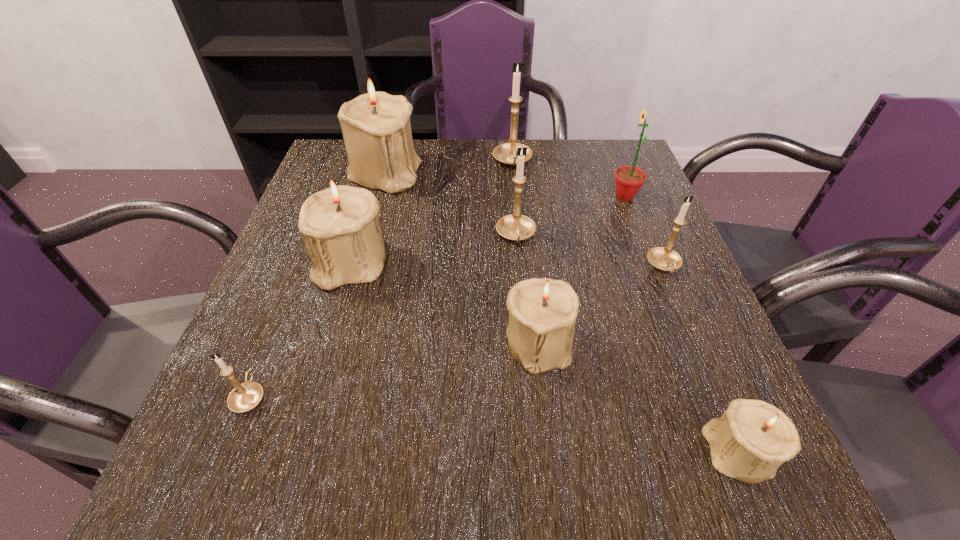
Where is `vacant area situated on the back of the second nearest beige candle_holder`? This screenshot has width=960, height=540. vacant area situated on the back of the second nearest beige candle_holder is located at coordinates (532, 288).

The image size is (960, 540). Identify the location of vacant space located on the handle side of the second nearest object. (310, 244).

I want to click on vacant point located 0.250m on the handle side of the second nearest object, so click(x=300, y=269).

This screenshot has width=960, height=540. In order to click on free space located on the handle side of the second nearest object in this screenshot , I will do `click(285, 307)`.

Find the location of a particular element. The width and height of the screenshot is (960, 540). free location located on the left of the nearest object is located at coordinates (485, 452).

This screenshot has height=540, width=960. I want to click on sunflower that is at the far edge, so click(629, 179).

Identify the location of object located in the near edge section of the desktop. (752, 439).

Image resolution: width=960 pixels, height=540 pixels. I want to click on sunflower that is at the right edge, so click(x=629, y=179).

You are a GUI agent. You are given a task and a screenshot of the screen. Output one action in this format:
    pyautogui.click(x=<x>, y=<y>)
    Task: Click on the object situated at the far left corner
    The width and height of the screenshot is (960, 540).
    Given the screenshot: What is the action you would take?
    pyautogui.click(x=376, y=128)

Where is `object that is at the far right corner`? The height and width of the screenshot is (540, 960). object that is at the far right corner is located at coordinates (629, 179).